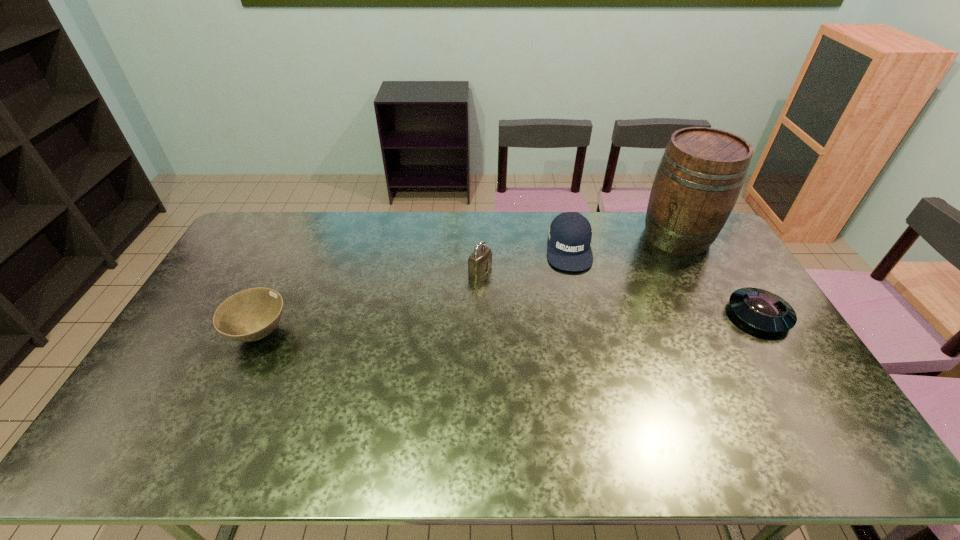
Locate an element on the screen. vacant space located 0.200m on the front-facing side of the baseball cap is located at coordinates (574, 316).

You are a GUI agent. You are given a task and a screenshot of the screen. Output one action in this format:
    pyautogui.click(x=<x>, y=<y>)
    Task: Click on the vacant space positioned 0.130m on the front-facing side of the baseball cap
    
    Given the screenshot: What is the action you would take?
    pyautogui.click(x=573, y=300)

Find the location of a particular element. The width and height of the screenshot is (960, 540). vacant position located on the front-facing side of the baseball cap is located at coordinates (576, 341).

Locate an element on the screen. The image size is (960, 540). free space located 0.360m on the side of the cider near the bung hole is located at coordinates (598, 300).

Find the location of `vacant space located on the side of the cider near the bung hole`. vacant space located on the side of the cider near the bung hole is located at coordinates (594, 303).

Where is `free space located on the side of the cider near the bung hole`? This screenshot has height=540, width=960. free space located on the side of the cider near the bung hole is located at coordinates (612, 288).

Locate an element on the screen. baseball cap at the far edge is located at coordinates pos(570,233).

Locate an element on the screen. This screenshot has height=540, width=960. cider that is at the far edge is located at coordinates (700, 176).

Find the location of a particular element. Image resolution: width=960 pixels, height=540 pixels. object present at the left edge is located at coordinates (249, 315).

I want to click on saucer that is at the right edge, so click(x=761, y=309).